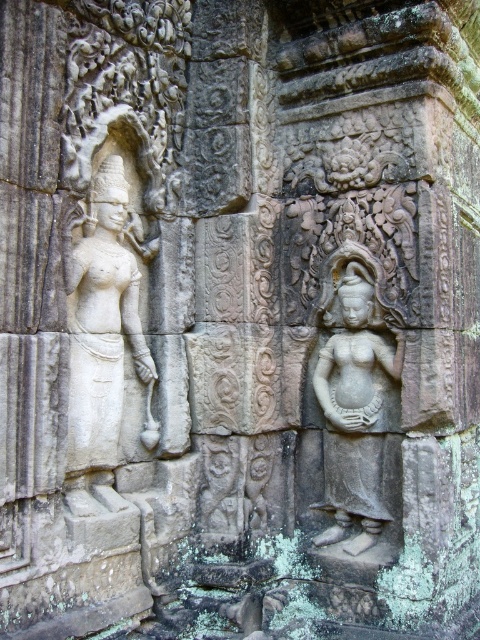
You are an archaeologist examining the ancient stone wall. You notice two points marked on the wall. The first point is at coordinates point (137, 374) and the second is at point (333, 416). Which of these points is nearer to your current position as you observe the wall?

Point (137, 374) is closer to the camera than point (333, 416), so the first point is nearer to your current position.

You are an archaeologist examining the ancient stone wall. You notice the white stone statue at left and the gray stone statue at center. Which statue is wider?

The gray stone statue at center is wider than the white stone statue at left.